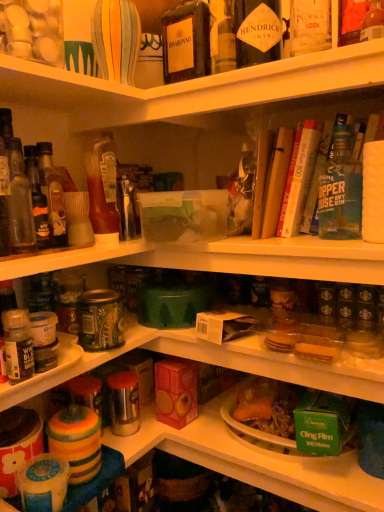
Question: In which direction should I rotate to look at clear plastic container at upper center, marked as the second shelf in a left-to-right arrangement?

Choices:
 (A) right
 (B) left

Answer: (A)

Question: Considering the relative sizes of translucent glass bottle at left, the 1th bottle in the left-to-right sequence, and green matte bottle at upper right, marked as the 7th bottle in a left-to-right arrangement, in the image provided, is translucent glass bottle at left, the 1th bottle in the left-to-right sequence, taller than green matte bottle at upper right, marked as the 7th bottle in a left-to-right arrangement,?

Choices:
 (A) no
 (B) yes

Answer: (A)

Question: Is translucent glass bottle at left, the 1th bottle in the left-to-right sequence, facing towards green matte bottle at upper right, marked as the 7th bottle in a left-to-right arrangement?

Choices:
 (A) yes
 (B) no

Answer: (B)

Question: Can you confirm if translucent glass bottle at left, the 7th bottle from the right, is shorter than green matte bottle at upper right, marked as the 7th bottle in a left-to-right arrangement?

Choices:
 (A) no
 (B) yes

Answer: (B)

Question: From a real-world perspective, is translucent glass bottle at left, the 7th bottle from the right, over green matte bottle at upper right, marked as the 7th bottle in a left-to-right arrangement?

Choices:
 (A) no
 (B) yes

Answer: (A)

Question: Can you confirm if translucent glass bottle at left, the 1th bottle in the left-to-right sequence, is thinner than green matte bottle at upper right, marked as the 7th bottle in a left-to-right arrangement?

Choices:
 (A) yes
 (B) no

Answer: (A)

Question: Is translucent glass bottle at left, the 1th bottle in the left-to-right sequence, next to green matte bottle at upper right, marked as the 7th bottle in a left-to-right arrangement?

Choices:
 (A) no
 (B) yes

Answer: (A)

Question: Is the surface of hardcover book at upper right, the 2th book in the right-to-left sequence, in direct contact with metallic silver canister at left, acting as the 1th shelf starting from the left?

Choices:
 (A) yes
 (B) no

Answer: (B)

Question: Can you confirm if hardcover book at upper right, arranged as the 2th book when viewed from the left, is bigger than metallic silver canister at left, the second shelf when ordered from right to left?

Choices:
 (A) no
 (B) yes

Answer: (A)

Question: Is hardcover book at upper right, arranged as the 2th book when viewed from the left, positioned behind metallic silver canister at left, acting as the 1th shelf starting from the left?

Choices:
 (A) no
 (B) yes

Answer: (B)

Question: Does hardcover book at upper right, the 2th book in the right-to-left sequence, have a greater height compared to metallic silver canister at left, the first shelf from the bottom?

Choices:
 (A) no
 (B) yes

Answer: (B)

Question: Could you tell me if hardcover book at upper right, arranged as the 2th book when viewed from the left, is turned towards metallic silver canister at left, the second shelf when ordered from right to left?

Choices:
 (A) no
 (B) yes

Answer: (A)

Question: Does hardcover book at upper right, the 2th book in the right-to-left sequence, have a lesser height compared to metallic silver canister at left, the 2th shelf viewed from the top?

Choices:
 (A) yes
 (B) no

Answer: (B)

Question: Is hardcover book at upper right, the 2th book in the right-to-left sequence, turned away from translucent glass bottle at upper left, the 3th bottle in the right-to-left sequence?

Choices:
 (A) no
 (B) yes

Answer: (A)